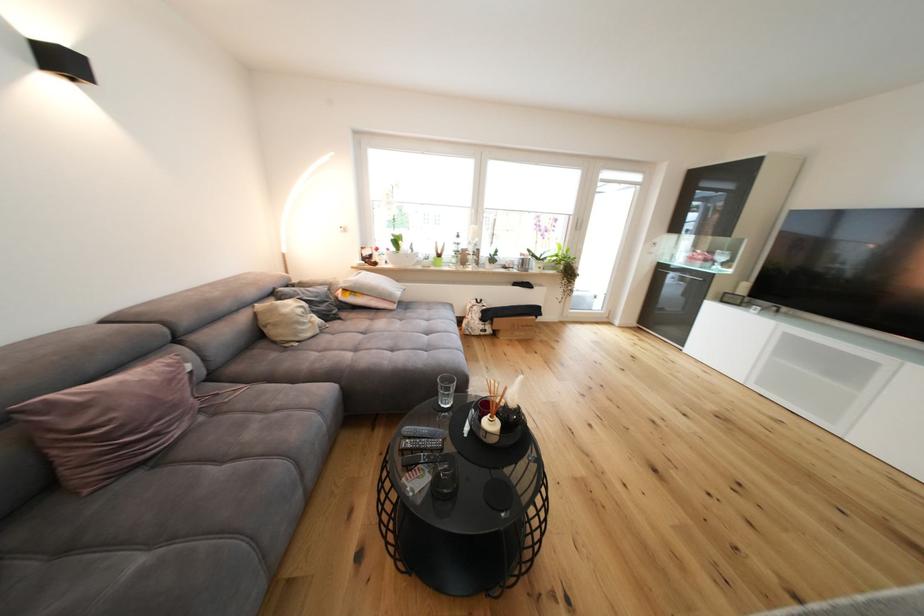
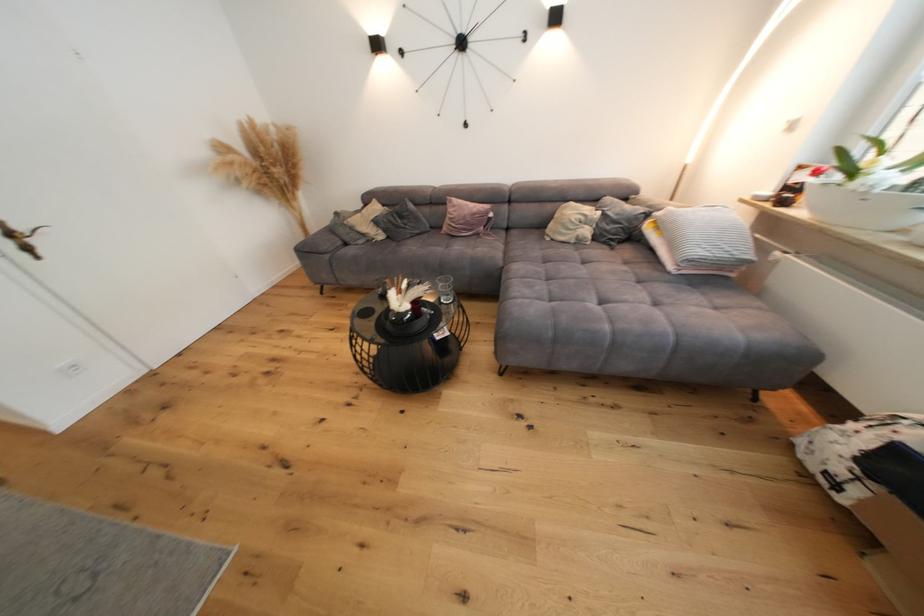
Where in the second image is the point corresponding to [373,254] from the first image?

(809, 179)